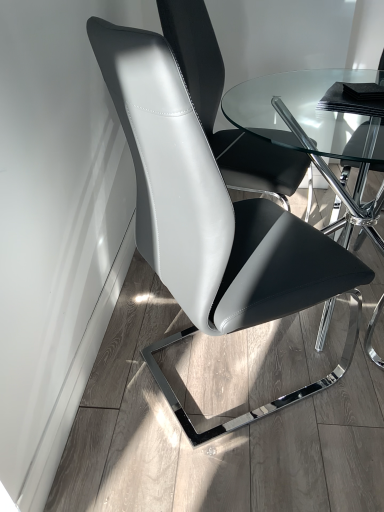
In the scene shown: Measure the distance between white leather chair at center, which appears as the first chair when viewed from the back, and camera.

They are 4.71 feet apart.

What do you see at coordinates (317, 130) in the screenshot? This screenshot has width=384, height=512. I see `transparent glass table at center` at bounding box center [317, 130].

What do you see at coordinates (212, 220) in the screenshot? I see `matte black chair at center, the 1th chair when ordered from front to back` at bounding box center [212, 220].

Find the location of `white leather chair at center, which appears as the first chair when viewed from the back`. white leather chair at center, which appears as the first chair when viewed from the back is located at coordinates (218, 106).

Considering the positions of objects matte black chair at center, the 1th chair when ordered from front to back, and white leather chair at center, the 2th chair viewed from the front, in the image provided, who is in front, matte black chair at center, the 1th chair when ordered from front to back, or white leather chair at center, the 2th chair viewed from the front,?

matte black chair at center, the 1th chair when ordered from front to back, is in front.

From the image's perspective, is matte black chair at center, the 1th chair when ordered from front to back, on white leather chair at center, the 2th chair viewed from the front?

Actually, matte black chair at center, the 1th chair when ordered from front to back, appears below white leather chair at center, the 2th chair viewed from the front, in the image.

Are matte black chair at center, the 1th chair when ordered from front to back, and white leather chair at center, which appears as the first chair when viewed from the back, located far from each other?

No, matte black chair at center, the 1th chair when ordered from front to back, is not far away from white leather chair at center, which appears as the first chair when viewed from the back.

Is matte black chair at center, positioned as the second chair in back-to-front order, to the left of white leather chair at center, which appears as the first chair when viewed from the back, from the viewer's perspective?

Yes.

Which object is thinner, white leather chair at center, the 2th chair viewed from the front, or matte black chair at center, positioned as the second chair in back-to-front order?

white leather chair at center, the 2th chair viewed from the front, is thinner.

From a real-world perspective, is white leather chair at center, the 2th chair viewed from the front, beneath matte black chair at center, positioned as the second chair in back-to-front order?

No, from a real-world perspective, white leather chair at center, the 2th chair viewed from the front, is not beneath matte black chair at center, positioned as the second chair in back-to-front order.

Who is smaller, white leather chair at center, the 2th chair viewed from the front, or matte black chair at center, the 1th chair when ordered from front to back?

With smaller size is white leather chair at center, the 2th chair viewed from the front.

Does white leather chair at center, which appears as the first chair when viewed from the back, have a lesser height compared to matte black chair at center, positioned as the second chair in back-to-front order?

Yes.

Considering the relative positions of matte black chair at center, the 1th chair when ordered from front to back, and transparent glass table at center in the image provided, is matte black chair at center, the 1th chair when ordered from front to back, to the left of transparent glass table at center from the viewer's perspective?

Correct, you'll find matte black chair at center, the 1th chair when ordered from front to back, to the left of transparent glass table at center.

Could you tell me if matte black chair at center, positioned as the second chair in back-to-front order, is turned towards transparent glass table at center?

Yes, matte black chair at center, positioned as the second chair in back-to-front order, is aimed at transparent glass table at center.

Which is closer to the camera, (x=162, y=147) or (x=324, y=150)?

Point (x=162, y=147) appears to be closer to the viewer than point (x=324, y=150).

How different are the orientations of matte black chair at center, the 1th chair when ordered from front to back, and transparent glass table at center in degrees?

33.3 degrees separate the facing orientations of matte black chair at center, the 1th chair when ordered from front to back, and transparent glass table at center.

From the image's perspective, who appears lower, white leather chair at center, the 2th chair viewed from the front, or transparent glass table at center?

transparent glass table at center, from the image's perspective.

In the image, there is a transparent glass table at center. What are the coordinates of `chair above it (from the image's perspective)` in the screenshot? It's located at (218, 106).

Between white leather chair at center, the 2th chair viewed from the front, and transparent glass table at center, which one appears on the right side from the viewer's perspective?

Positioned to the right is transparent glass table at center.

Does transparent glass table at center appear on the left side of white leather chair at center, which appears as the first chair when viewed from the back?

No, transparent glass table at center is not to the left of white leather chair at center, which appears as the first chair when viewed from the back.

From their relative heights in the image, would you say transparent glass table at center is taller or shorter than white leather chair at center, the 2th chair viewed from the front?

Considering their sizes, transparent glass table at center has less height than white leather chair at center, the 2th chair viewed from the front.

Does point (257, 117) appear closer or farther from the camera than point (209, 136)?

Point (257, 117) is positioned farther from the camera compared to point (209, 136).

Does transparent glass table at center touch white leather chair at center, the 2th chair viewed from the front?

No, transparent glass table at center is not next to white leather chair at center, the 2th chair viewed from the front.

From a real-world perspective, which is physically below, transparent glass table at center or matte black chair at center, positioned as the second chair in back-to-front order?

From a 3D spatial view, transparent glass table at center is below.

Can you tell me how much transparent glass table at center and matte black chair at center, the 1th chair when ordered from front to back, differ in facing direction?

33.3 degrees separate the facing orientations of transparent glass table at center and matte black chair at center, the 1th chair when ordered from front to back.

Is transparent glass table at center positioned far away from matte black chair at center, positioned as the second chair in back-to-front order?

No.

From the image's perspective, is transparent glass table at center beneath matte black chair at center, the 1th chair when ordered from front to back?

No.

The height and width of the screenshot is (512, 384). I want to click on chair below the white leather chair at center, the 2th chair viewed from the front (from a real-world perspective), so pos(212,220).

You are a GUI agent. You are given a task and a screenshot of the screen. Output one action in this format:
    pyautogui.click(x=<x>, y=<y>)
    Task: Click on the chair in front of the white leather chair at center, the 2th chair viewed from the front
    
    Given the screenshot: What is the action you would take?
    pyautogui.click(x=212, y=220)

When comparing their distances from matte black chair at center, the 1th chair when ordered from front to back, does transparent glass table at center or white leather chair at center, which appears as the first chair when viewed from the back, seem closer?

white leather chair at center, which appears as the first chair when viewed from the back, is closer to matte black chair at center, the 1th chair when ordered from front to back.

Which object lies nearer to the anchor point transparent glass table at center, matte black chair at center, positioned as the second chair in back-to-front order, or white leather chair at center, the 2th chair viewed from the front?

Based on the image, white leather chair at center, the 2th chair viewed from the front, appears to be nearer to transparent glass table at center.

Considering their positions, is matte black chair at center, positioned as the second chair in back-to-front order, positioned further to white leather chair at center, the 2th chair viewed from the front, than transparent glass table at center?

matte black chair at center, positioned as the second chair in back-to-front order, is further to white leather chair at center, the 2th chair viewed from the front.

From the image, which object appears to be farther from transparent glass table at center, white leather chair at center, which appears as the first chair when viewed from the back, or matte black chair at center, positioned as the second chair in back-to-front order?

Among the two, matte black chair at center, positioned as the second chair in back-to-front order, is located further to transparent glass table at center.

When comparing their distances from matte black chair at center, positioned as the second chair in back-to-front order, does white leather chair at center, which appears as the first chair when viewed from the back, or transparent glass table at center seem further?

transparent glass table at center lies further to matte black chair at center, positioned as the second chair in back-to-front order, than the other object.

From the image, which object appears to be nearer to white leather chair at center, which appears as the first chair when viewed from the back, transparent glass table at center or matte black chair at center, the 1th chair when ordered from front to back?

transparent glass table at center.

The image size is (384, 512). In order to click on table between matte black chair at center, the 1th chair when ordered from front to back, and white leather chair at center, which appears as the first chair when viewed from the back, along the z-axis in this screenshot , I will do `click(317, 130)`.